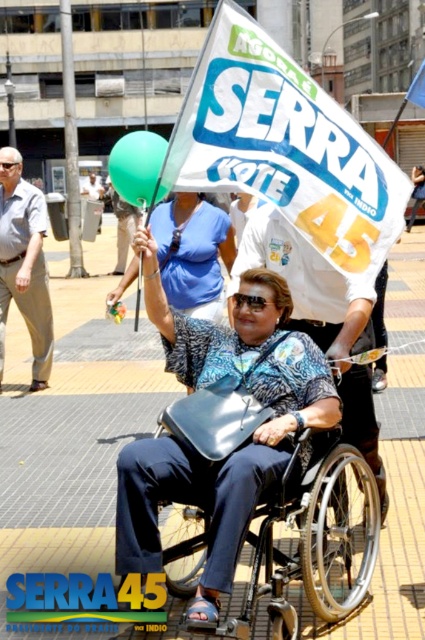
Question: Which object is closer to the camera taking this photo?

Choices:
 (A) black leather wheelchair at center
 (B) white paper sign at upper center
 (C) light beige pants at left

Answer: (A)

Question: Which of these objects is positioned closest to the blue printed shirt at center?

Choices:
 (A) white paper sign at upper center
 (B) black leather wheelchair at center
 (C) light beige pants at left

Answer: (A)

Question: Which object appears closest to the camera in this image?

Choices:
 (A) blue printed shirt at center
 (B) white paper sign at upper center
 (C) black plastic goggles at upper center

Answer: (B)

Question: Can you confirm if matte blue shirt at center is positioned to the right of blue printed shirt at center?

Choices:
 (A) no
 (B) yes

Answer: (A)

Question: From the image, what is the correct spatial relationship of white paper sign at upper center in relation to green rubber balloon at upper center?

Choices:
 (A) above
 (B) below

Answer: (B)

Question: Can you confirm if white paper sign at upper center is positioned above black leather wheelchair at center?

Choices:
 (A) no
 (B) yes

Answer: (B)